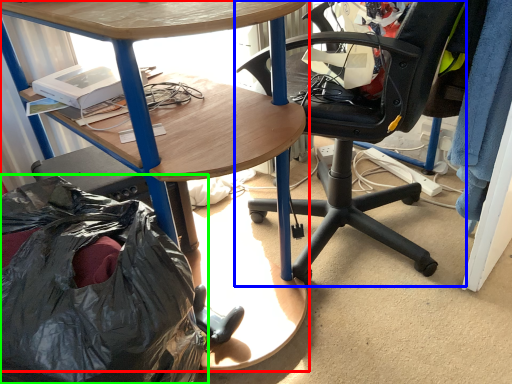
Question: Estimate the real-world distances between objects in this image. Which object is farther from desk (highlighted by a red box), chair (highlighted by a blue box) or garbage (highlighted by a green box)?

Choices:
 (A) chair
 (B) garbage

Answer: (A)